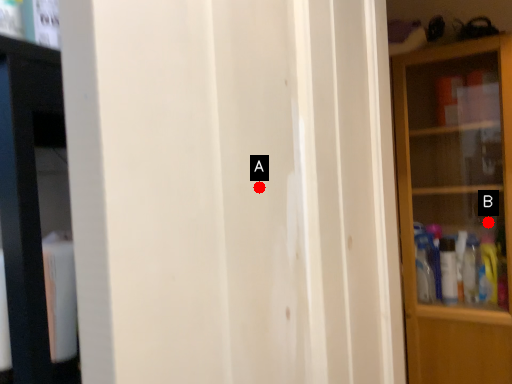
Question: Two points are circled on the image, labeled by A and B beside each circle. Which point appears farthest from the camera in this image?

Choices:
 (A) A is further
 (B) B is further

Answer: (B)